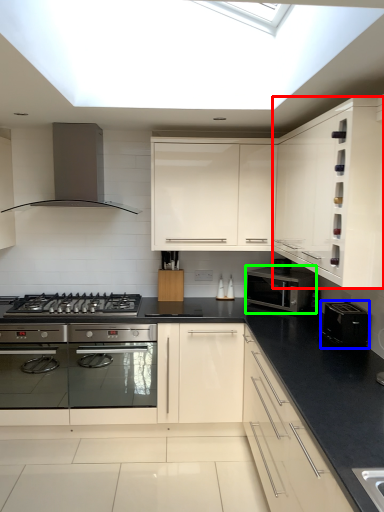
Question: Considering the real-world distances, which object is farthest from cabinetry (highlighted by a red box)? appliance (highlighted by a blue box) or microwave oven (highlighted by a green box)?

Choices:
 (A) appliance
 (B) microwave oven

Answer: (B)